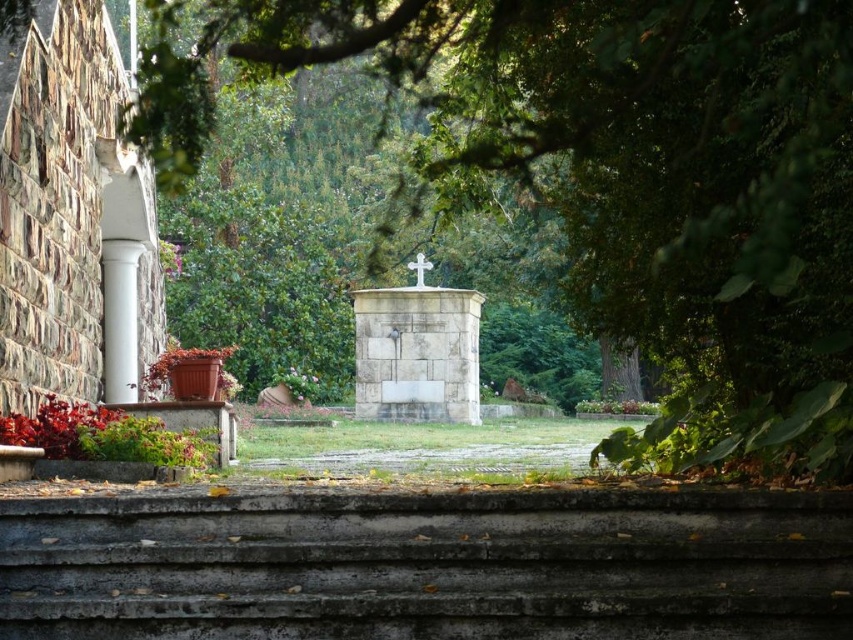
You are standing on the concrete steps at center and want to reach the white marble column at left. According to the scene description, which direction should you move to get closer to the column?

The concrete steps at center is below the white marble column at left, so you should move upward to reach the white marble column at left.

You are standing at the base of the concrete steps at center and want to walk towards the white marble column at left. Which direction should you turn to reach it?

You should turn to your left to reach the white marble column at left because the concrete steps at center is to the right of it.

You are standing at the base of the stone steps in the garden scene. You see two points marked on the ground, one at coordinates point (x=270, y=508) and the other at point (x=134, y=291). Which of these points is closer to you as you face the steps?

Point (x=270, y=508) is in front of point (x=134, y=291), so it is closer to you as you face the steps.